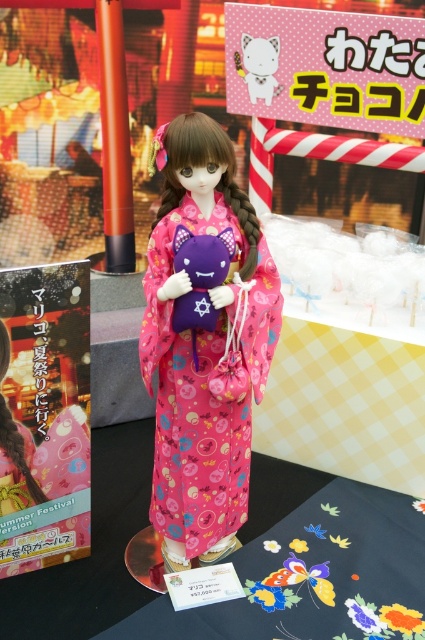
You are a guest at the event and want to take a photo with the doll. The pink satin kimono at center and the white matte plush cat at center are both in the frame. If you want the plush cat to appear bigger in your photo, what should you do?

To make the white matte plush cat at center appear bigger in the photo, move closer to it while keeping both the pink satin kimono at center and the white matte plush cat at center in the frame.